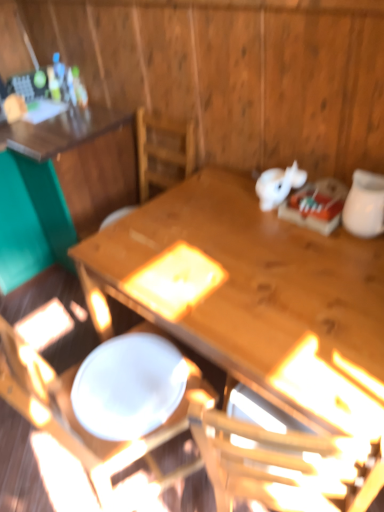
The image size is (384, 512). I want to click on vacant space situated above wooden table at center, which is the 2th table in left-to-right order (from a real-world perspective), so click(x=249, y=250).